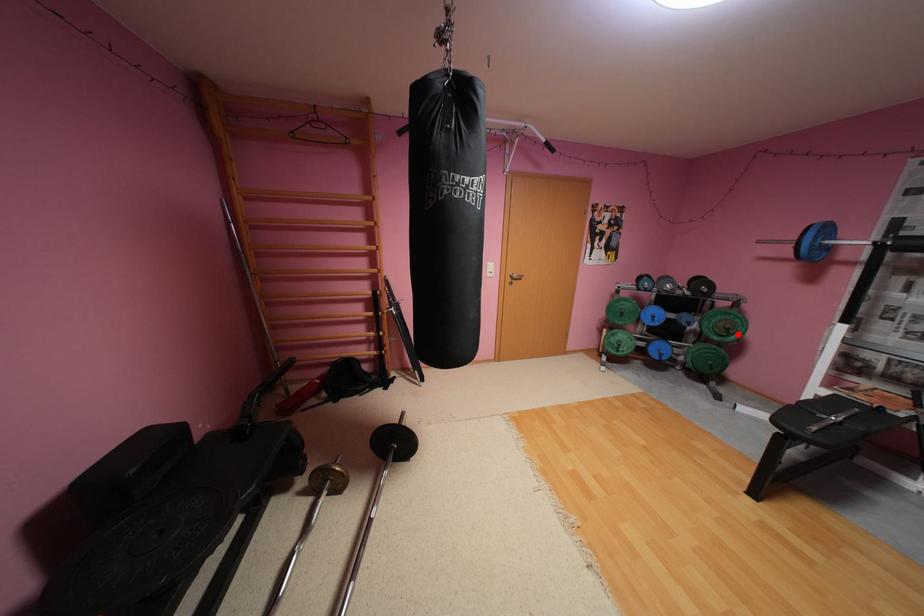
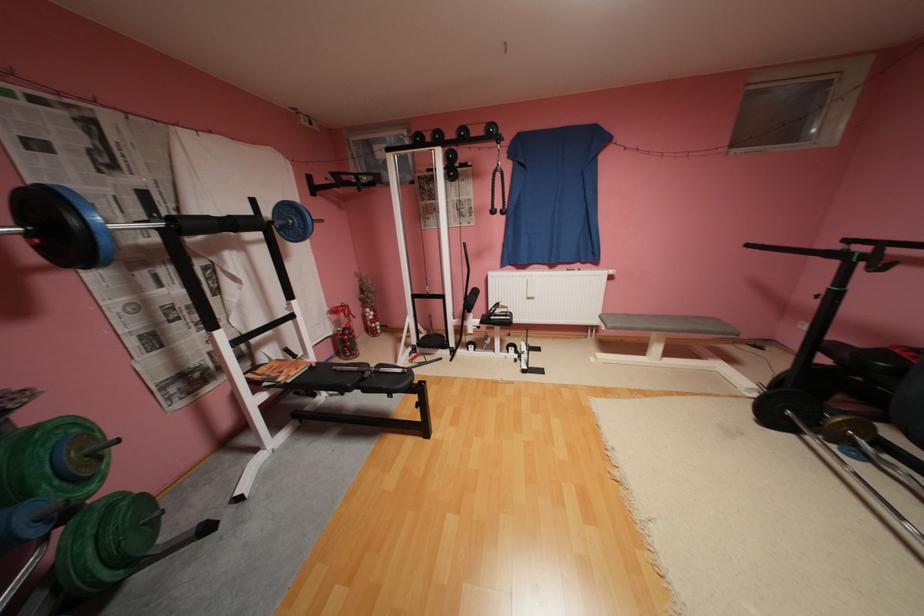
Question: I am providing you with two images of the same scene from different viewpoints. Image1 has a red point marked. In image2, the corresponding 3D location appears at what relative position? Reply with the corresponding letter.

Choices:
 (A) Closer
 (B) Farther

Answer: (B)